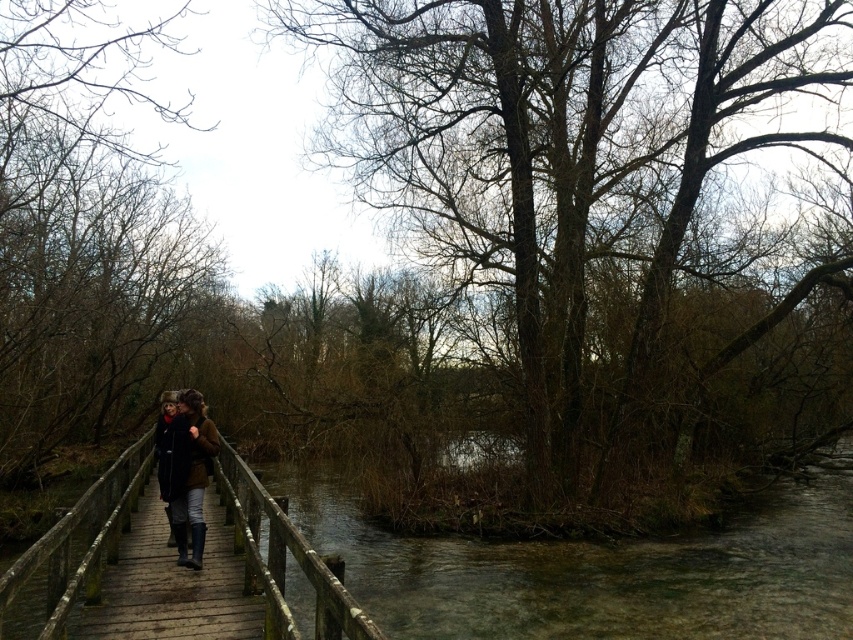
Consider the image. Does wooden planks at center have a greater height compared to black leather coat at center?

In fact, wooden planks at center may be shorter than black leather coat at center.

Can you confirm if wooden planks at center is positioned to the right of black leather coat at center?

Yes, wooden planks at center is to the right of black leather coat at center.

Is point (273, 499) farther from camera compared to point (155, 442)?

No, it is in front of (155, 442).

Image resolution: width=853 pixels, height=640 pixels. In order to click on wooden planks at center in this screenshot , I will do `click(171, 564)`.

Does clear water at center appear on the left side of wooden planks at center?

No, clear water at center is not to the left of wooden planks at center.

Is clear water at center bigger than wooden planks at center?

Indeed, clear water at center has a larger size compared to wooden planks at center.

Between point (694, 580) and point (253, 554), which one is positioned behind?

The point (694, 580) is behind.

What are the coordinates of `clear water at center` in the screenshot? It's located at (601, 570).

Between point (138, 609) and point (180, 531), which one is positioned in front?

Positioned in front is point (138, 609).

Is wooden planks at center positioned behind brown leather jacket at center?

Yes, it is.

Is point (221, 556) less distant than point (181, 417)?

No, it is behind (181, 417).

The width and height of the screenshot is (853, 640). Find the location of `wooden planks at center`. wooden planks at center is located at coordinates (171, 564).